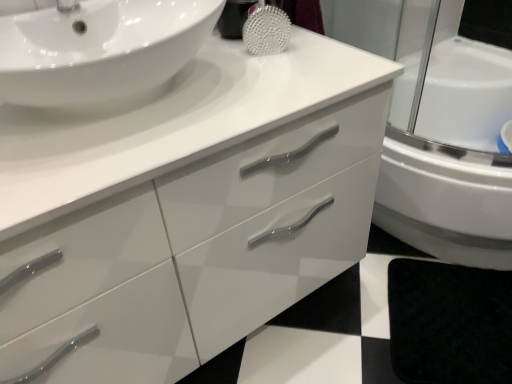
Where is `vacant space to the right of white glossy sink at upper left`? vacant space to the right of white glossy sink at upper left is located at coordinates (279, 78).